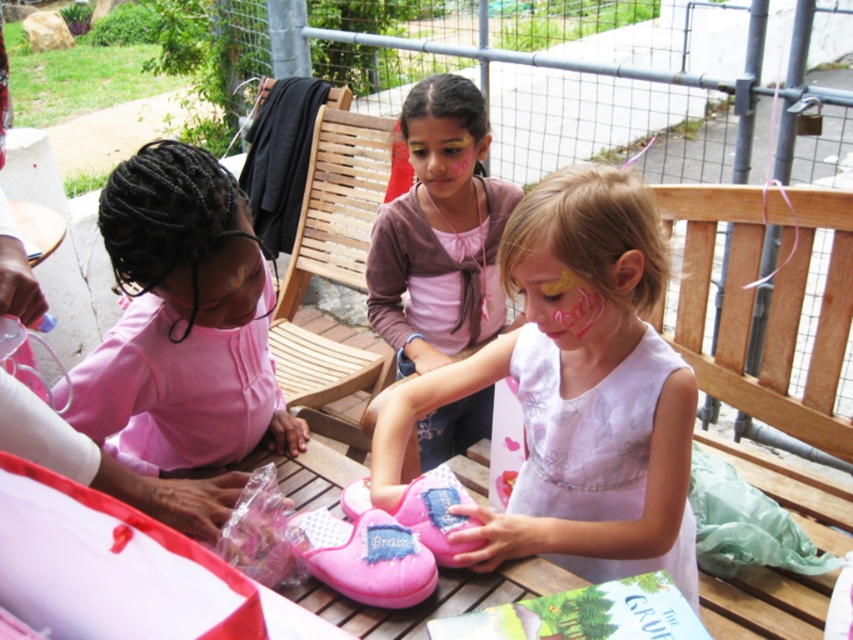
You are a tailor measuring the width of the pink fabric shoes at center and the pink satin dress at center. Which object has a greater width?

The pink fabric shoes at center might be wider than pink satin dress at center according to the description.